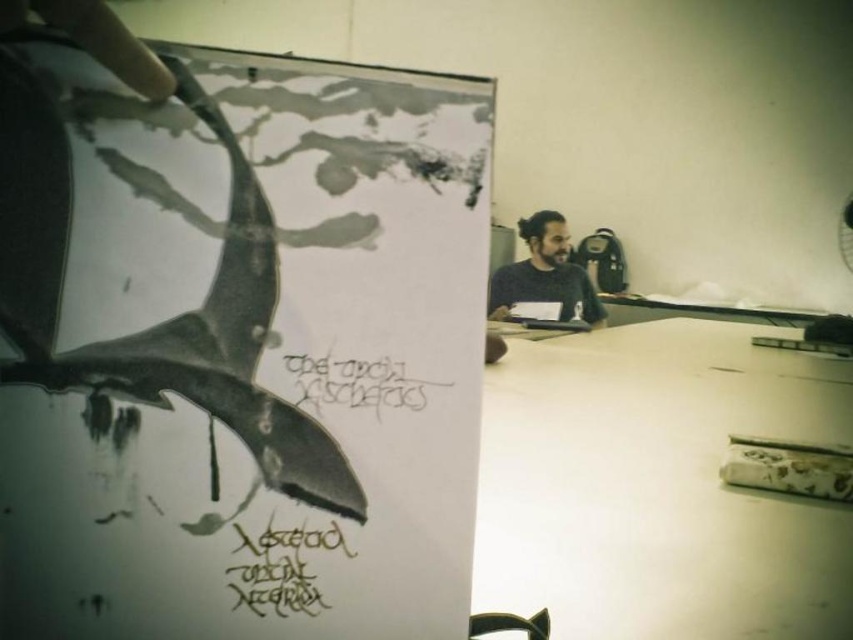
Question: Can you confirm if black paper poster at left is positioned to the left of black ink writing at center?

Choices:
 (A) no
 (B) yes

Answer: (B)

Question: Which point is closer to the camera?

Choices:
 (A) brown calligraphy at center
 (B) black ink writing at center

Answer: (A)

Question: Which is farther from the black paper poster at left?

Choices:
 (A) black ink writing at center
 (B) black matte shirt at upper right
 (C) brown calligraphy at center

Answer: (B)

Question: Which object appears farthest from the camera in this image?

Choices:
 (A) white matte table at center
 (B) black ink writing at center

Answer: (A)

Question: Does black paper poster at left have a lesser width compared to brown calligraphy at center?

Choices:
 (A) no
 (B) yes

Answer: (A)

Question: Is white matte table at center to the left of brown calligraphy at center from the viewer's perspective?

Choices:
 (A) no
 (B) yes

Answer: (A)